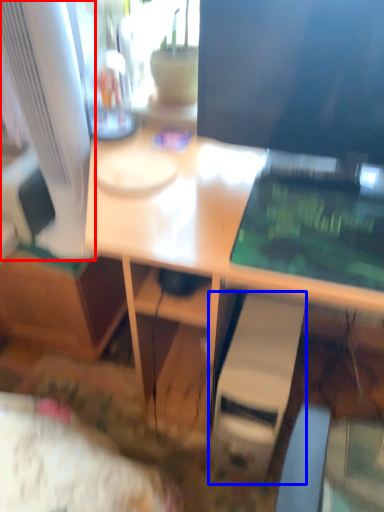
Question: Which object is further to the camera taking this photo, computer monitor (highlighted by a red box) or computer tower (highlighted by a blue box)?

Choices:
 (A) computer monitor
 (B) computer tower

Answer: (B)